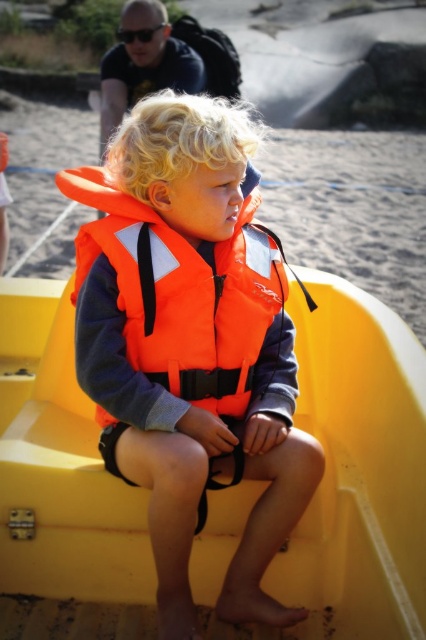
In the scene shown: Which is above, orange fabric life vest at center or orange fabric life jacket at center?

orange fabric life jacket at center is higher up.

Is orange fabric life vest at center above orange fabric life jacket at center?

Incorrect, orange fabric life vest at center is not positioned above orange fabric life jacket at center.

This screenshot has height=640, width=426. Identify the location of orange fabric life vest at center. click(192, 344).